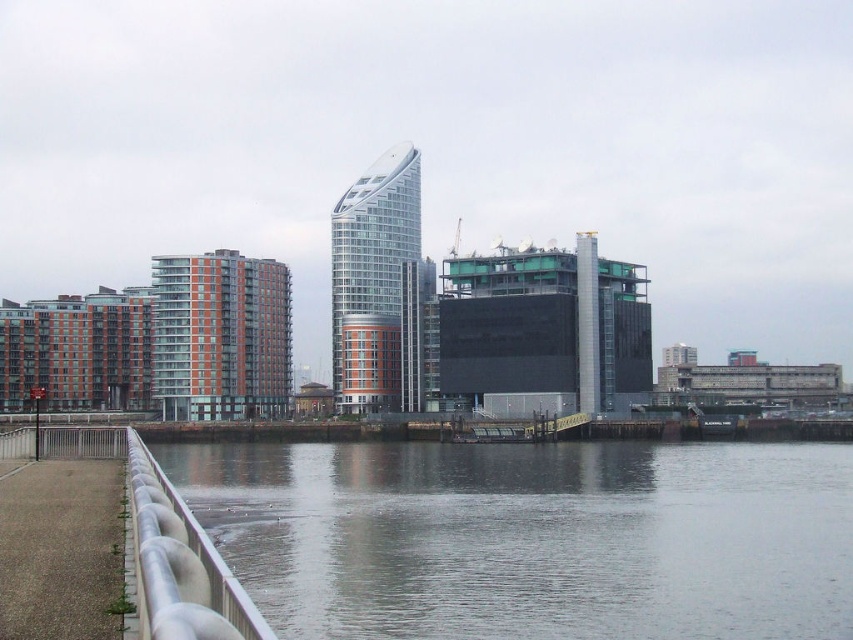
Question: Does smooth gray water at lower center have a larger size compared to white glossy rail at lower left?

Choices:
 (A) yes
 (B) no

Answer: (A)

Question: Does smooth gray water at lower center have a lesser width compared to white glossy rail at lower left?

Choices:
 (A) yes
 (B) no

Answer: (B)

Question: Which point appears closest to the camera in this image?

Choices:
 (A) (149, 493)
 (B) (553, 608)

Answer: (A)

Question: Can you confirm if smooth gray water at lower center is positioned above white glossy rail at lower left?

Choices:
 (A) no
 (B) yes

Answer: (A)

Question: Among these points, which one is nearest to the camera?

Choices:
 (A) (241, 604)
 (B) (296, 515)

Answer: (A)

Question: Which object appears farthest from the camera in this image?

Choices:
 (A) smooth gray water at lower center
 (B) white glossy rail at lower left

Answer: (A)